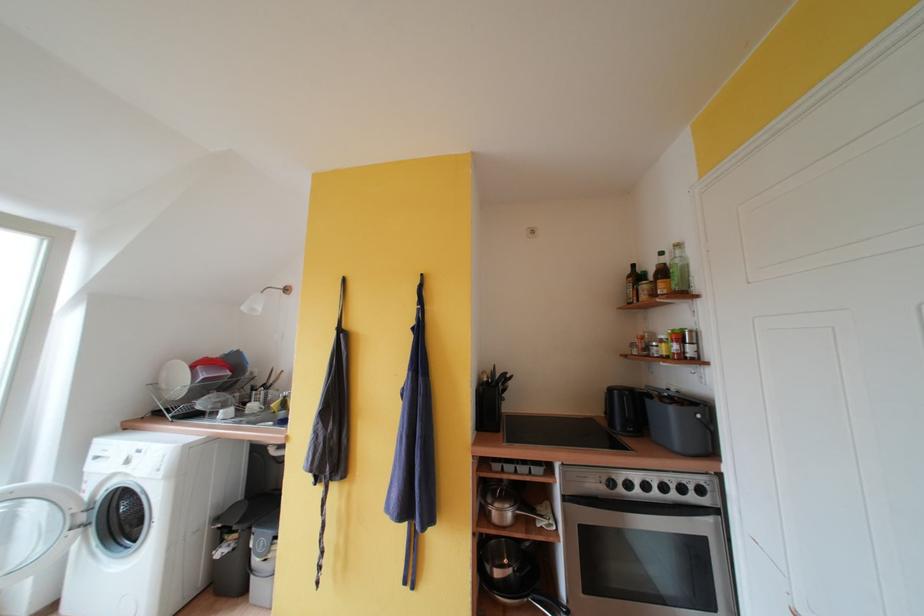
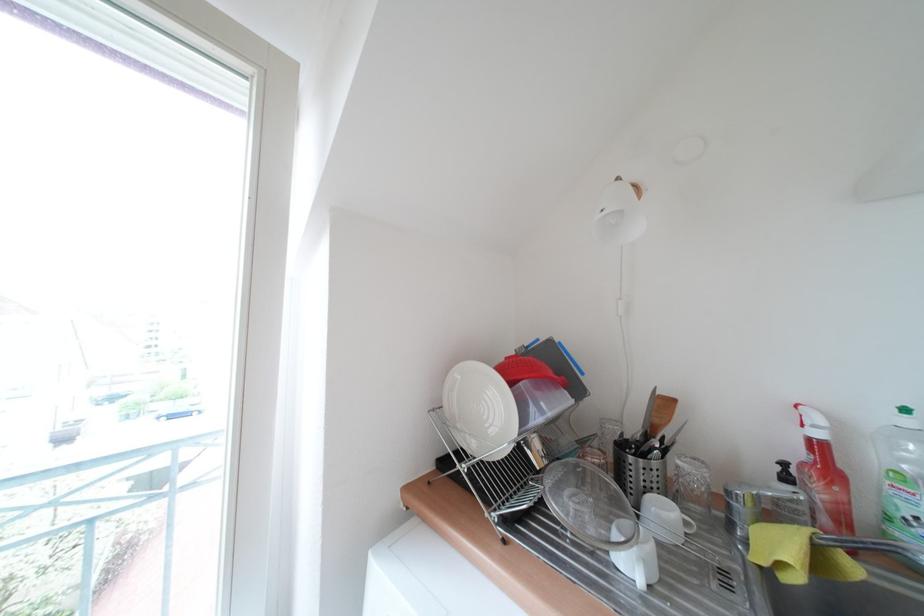
In the second image, find the point that corresponds to point (160, 387) in the first image.

(444, 413)